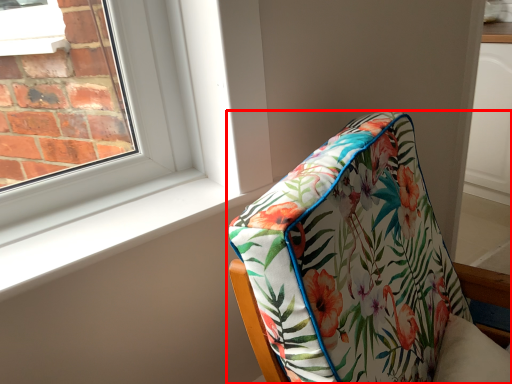
Question: From the image's perspective, considering the relative positions of furniture (annotated by the red box) and window sill in the image provided, where is furniture (annotated by the red box) located with respect to the staircase?

Choices:
 (A) below
 (B) above

Answer: (A)